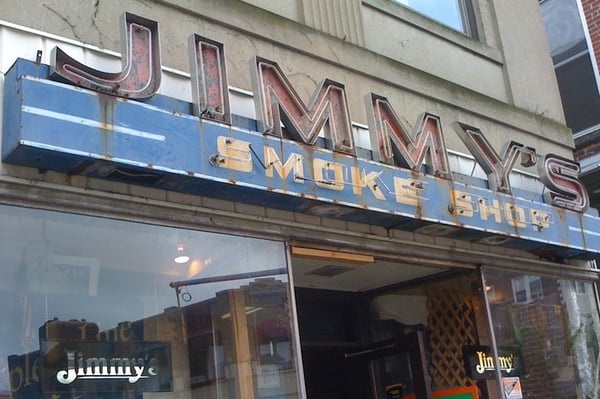
What are the coordinates of `doorway entrance` in the screenshot? It's located at (373, 372).